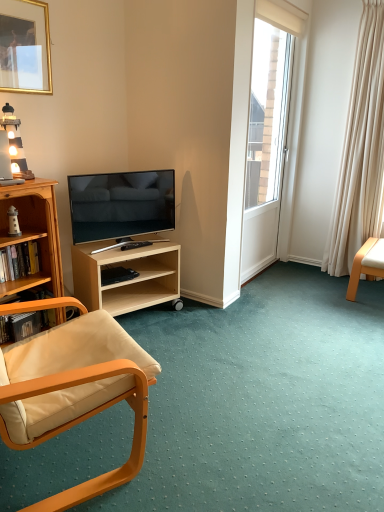
Question: From a real-world perspective, is light wood/finishedobject at center, the first shelf when ordered from right to left, physically above matte black tv at center left?

Choices:
 (A) no
 (B) yes

Answer: (A)

Question: Is light wood/finishedobject at center, marked as the 2th shelf in a left-to-right arrangement, positioned with its back to matte black tv at center left?

Choices:
 (A) yes
 (B) no

Answer: (B)

Question: Could you tell me if light wood/finishedobject at center, the first shelf when ordered from right to left, is turned towards matte black tv at center left?

Choices:
 (A) yes
 (B) no

Answer: (B)

Question: Considering the relative positions of light wood/finishedobject at center, marked as the 2th shelf in a left-to-right arrangement, and matte black tv at center left in the image provided, is light wood/finishedobject at center, marked as the 2th shelf in a left-to-right arrangement, to the left of matte black tv at center left from the viewer's perspective?

Choices:
 (A) yes
 (B) no

Answer: (A)

Question: From the image's perspective, would you say light wood/finishedobject at center, marked as the 2th shelf in a left-to-right arrangement, is shown under matte black tv at center left?

Choices:
 (A) no
 (B) yes

Answer: (B)

Question: Is light wood/finishedobject at center, the first shelf when ordered from right to left, touching matte black tv at center left?

Choices:
 (A) yes
 (B) no

Answer: (B)

Question: From the image's perspective, does wooden bookshelf at lower left, positioned as the 2th shelf in right-to-left order, appear higher than white leather chair at right, the second chair viewed from the left?

Choices:
 (A) no
 (B) yes

Answer: (A)

Question: Is wooden bookshelf at lower left, positioned as the 2th shelf in right-to-left order, wider than white leather chair at right, marked as the first chair in a right-to-left arrangement?

Choices:
 (A) yes
 (B) no

Answer: (B)

Question: Can you confirm if wooden bookshelf at lower left, positioned as the 2th shelf in right-to-left order, is shorter than white leather chair at right, marked as the first chair in a right-to-left arrangement?

Choices:
 (A) yes
 (B) no

Answer: (A)

Question: Is wooden bookshelf at lower left, acting as the 1th shelf starting from the left, behind white leather chair at right, marked as the first chair in a right-to-left arrangement?

Choices:
 (A) yes
 (B) no

Answer: (B)

Question: From a real-world perspective, is wooden bookshelf at lower left, acting as the 1th shelf starting from the left, below white leather chair at right, which appears as the 1th chair when viewed from the back?

Choices:
 (A) no
 (B) yes

Answer: (B)

Question: Would you say wooden bookshelf at lower left, positioned as the 2th shelf in right-to-left order, is outside white leather chair at right, the second chair viewed from the left?

Choices:
 (A) yes
 (B) no

Answer: (A)

Question: Is wooden lighthouse at upper left to the right of matte black tv at center left from the viewer's perspective?

Choices:
 (A) no
 (B) yes

Answer: (A)